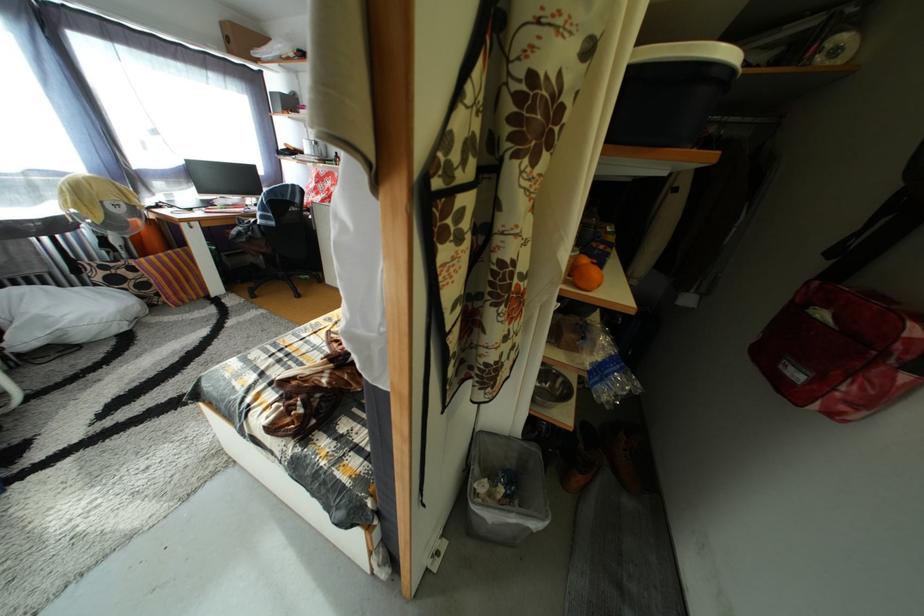
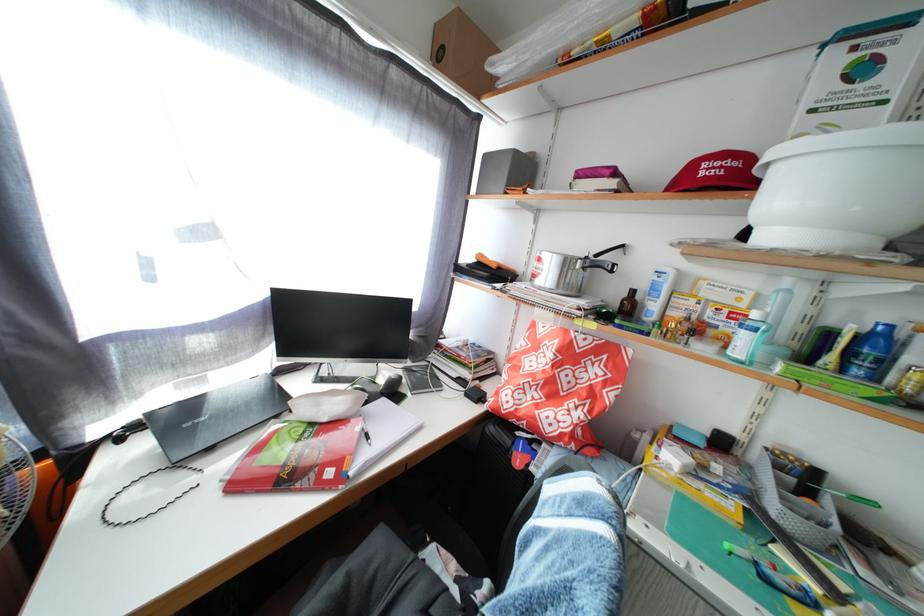
Consider the image. What movement of the cameraman would produce the second image?

The cameraman moved toward left, forward.